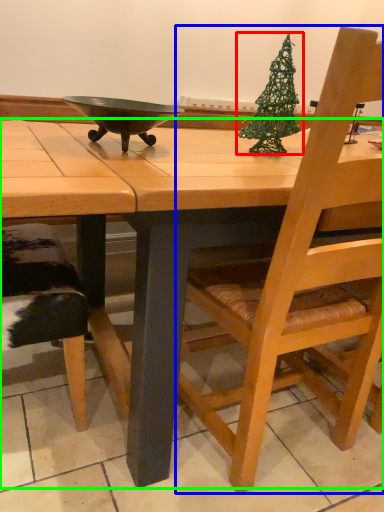
Question: Which is nearer to the christmas tree (highlighted by a red box)? chair (highlighted by a blue box) or desk (highlighted by a green box).

Choices:
 (A) chair
 (B) desk

Answer: (B)